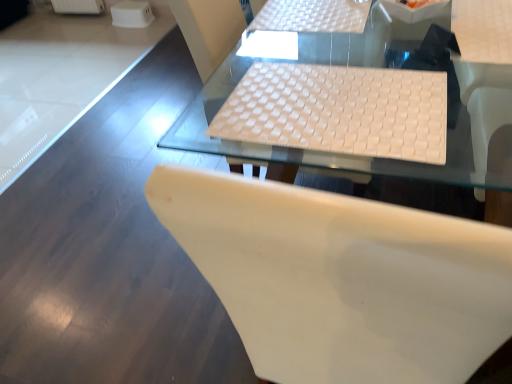
Identify the location of empty space that is ontop of white woven fabric laptop keyboard at center (from a real-world perspective). (333, 109).